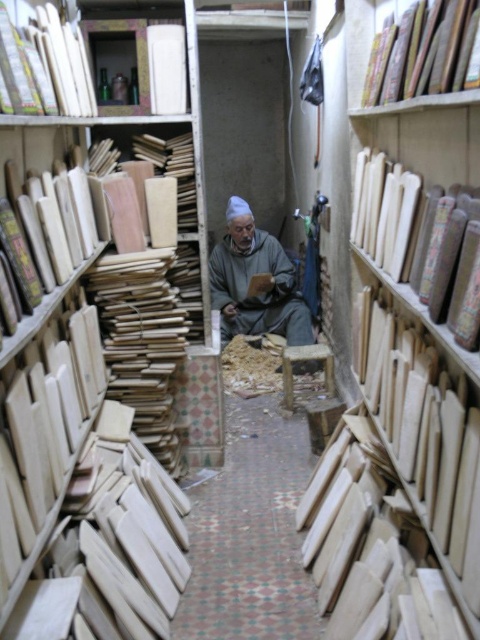
You are a carpenter in the workshop and need to reach the smooth wood plank at upper left to cut it. Can you safely stand on the light brown wood bookshelf at left to do so?

The light brown wood bookshelf at left is positioned under the smooth wood plank at upper left, so you can safely stand on the light brown wood bookshelf at left to reach the smooth wood plank at upper left for cutting.

You are standing in the workshop and want to reach the two points marked in the image. Which point, point (x=15, y=536) or point (x=86, y=108), is closer to you?

Point (x=15, y=536) is closer to you than point (x=86, y=108).

You are organizing a bookshelf and need to place the hardcover book at upper right and the smooth wood plank at upper left. Which object has a smaller width?

The hardcover book at upper right has a smaller width than the smooth wood plank at upper left.